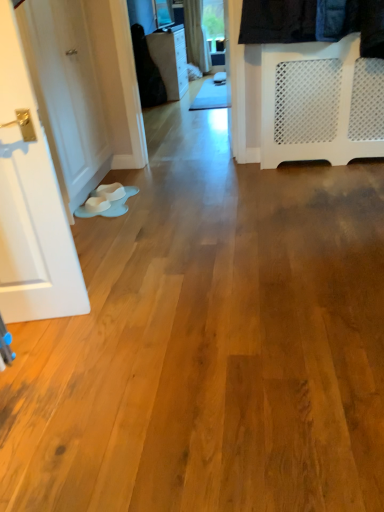
Question: Considering the relative sizes of matte black dresser at upper center and white painted wood door at left in the image provided, is matte black dresser at upper center smaller than white painted wood door at left?

Choices:
 (A) no
 (B) yes

Answer: (A)

Question: Is matte black dresser at upper center not within white painted wood door at left?

Choices:
 (A) yes
 (B) no

Answer: (A)

Question: Is matte black dresser at upper center in contact with white painted wood door at left?

Choices:
 (A) no
 (B) yes

Answer: (A)

Question: Does matte black dresser at upper center have a lesser width compared to white painted wood door at left?

Choices:
 (A) no
 (B) yes

Answer: (A)

Question: From a real-world perspective, does matte black dresser at upper center sit lower than white painted wood door at left?

Choices:
 (A) yes
 (B) no

Answer: (A)

Question: Is matte black dresser at upper center to the left of white painted wood door at left from the viewer's perspective?

Choices:
 (A) yes
 (B) no

Answer: (B)

Question: Is matte black dresser at upper center to the right of black fabric at upper left from the viewer's perspective?

Choices:
 (A) yes
 (B) no

Answer: (A)

Question: Does matte black dresser at upper center have a greater height compared to black fabric at upper left?

Choices:
 (A) yes
 (B) no

Answer: (B)

Question: From the image's perspective, would you say matte black dresser at upper center is shown under black fabric at upper left?

Choices:
 (A) yes
 (B) no

Answer: (B)

Question: Is matte black dresser at upper center completely or partially outside of black fabric at upper left?

Choices:
 (A) no
 (B) yes

Answer: (B)

Question: From the image's perspective, would you say matte black dresser at upper center is positioned over black fabric at upper left?

Choices:
 (A) no
 (B) yes

Answer: (B)

Question: Does matte black dresser at upper center appear on the left side of black fabric at upper left?

Choices:
 (A) yes
 (B) no

Answer: (B)

Question: Is black fabric at upper left smaller than matte black dresser at upper center?

Choices:
 (A) yes
 (B) no

Answer: (A)